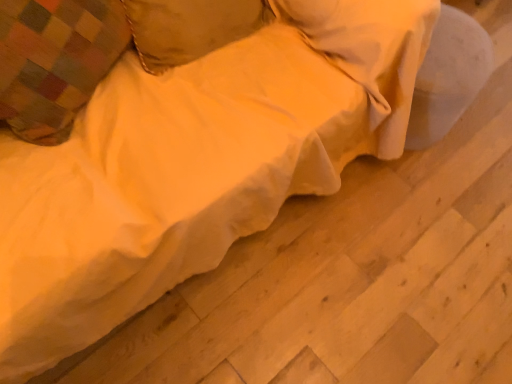
What is the approximate width of soft yellow fabric pillow at upper center, the second pillow positioned from the left?

soft yellow fabric pillow at upper center, the second pillow positioned from the left, is 8.26 inches in width.

The width and height of the screenshot is (512, 384). What do you see at coordinates (189, 28) in the screenshot?
I see `soft yellow fabric pillow at upper center, arranged as the first pillow when viewed from the right` at bounding box center [189, 28].

At what (x,y) coordinates should I click in order to perform the action: click on soft yellow fabric pillow at upper center, arranged as the first pillow when viewed from the right. Please return your answer as a coordinate pair (x, y). The height and width of the screenshot is (384, 512). Looking at the image, I should click on (189, 28).

You are a GUI agent. You are given a task and a screenshot of the screen. Output one action in this format:
    pyautogui.click(x=<x>, y=<y>)
    Task: Click on the plaid fabric pillow at upper left, placed as the first pillow when sorted from left to right
    The image size is (512, 384).
    Given the screenshot: What is the action you would take?
    pyautogui.click(x=55, y=61)

What is the approximate width of plaid fabric pillow at upper left, placed as the first pillow when sorted from left to right?

plaid fabric pillow at upper left, placed as the first pillow when sorted from left to right, is 8.71 inches wide.

The width and height of the screenshot is (512, 384). What do you see at coordinates (55, 61) in the screenshot? I see `plaid fabric pillow at upper left, placed as the first pillow when sorted from left to right` at bounding box center [55, 61].

This screenshot has width=512, height=384. I want to click on soft yellow fabric pillow at upper center, arranged as the first pillow when viewed from the right, so click(x=189, y=28).

Which object is positioned more to the right, plaid fabric pillow at upper left, the 2th pillow when ordered from right to left, or soft yellow fabric pillow at upper center, the second pillow positioned from the left?

Positioned to the right is soft yellow fabric pillow at upper center, the second pillow positioned from the left.

Does plaid fabric pillow at upper left, placed as the first pillow when sorted from left to right, lie behind soft yellow fabric pillow at upper center, the second pillow positioned from the left?

No.

Does point (118, 35) appear closer or farther from the camera than point (185, 39)?

Point (118, 35) is closer to the camera than point (185, 39).

From the image's perspective, is plaid fabric pillow at upper left, the 2th pillow when ordered from right to left, located above or below soft yellow fabric pillow at upper center, the second pillow positioned from the left?

plaid fabric pillow at upper left, the 2th pillow when ordered from right to left, is situated lower than soft yellow fabric pillow at upper center, the second pillow positioned from the left, in the image.

From a real-world perspective, is plaid fabric pillow at upper left, placed as the first pillow when sorted from left to right, positioned above or below soft yellow fabric pillow at upper center, arranged as the first pillow when viewed from the right?

plaid fabric pillow at upper left, placed as the first pillow when sorted from left to right, is above soft yellow fabric pillow at upper center, arranged as the first pillow when viewed from the right.

Which object is wider, plaid fabric pillow at upper left, the 2th pillow when ordered from right to left, or soft yellow fabric pillow at upper center, the second pillow positioned from the left?

With larger width is plaid fabric pillow at upper left, the 2th pillow when ordered from right to left.

Considering the sizes of plaid fabric pillow at upper left, the 2th pillow when ordered from right to left, and soft yellow fabric pillow at upper center, the second pillow positioned from the left, in the image, is plaid fabric pillow at upper left, the 2th pillow when ordered from right to left, taller or shorter than soft yellow fabric pillow at upper center, the second pillow positioned from the left,?

In the image, plaid fabric pillow at upper left, the 2th pillow when ordered from right to left, appears to be taller than soft yellow fabric pillow at upper center, the second pillow positioned from the left.

In terms of size, does plaid fabric pillow at upper left, the 2th pillow when ordered from right to left, appear bigger or smaller than soft yellow fabric pillow at upper center, arranged as the first pillow when viewed from the right?

In the image, plaid fabric pillow at upper left, the 2th pillow when ordered from right to left, appears to be larger than soft yellow fabric pillow at upper center, arranged as the first pillow when viewed from the right.

Would you say plaid fabric pillow at upper left, the 2th pillow when ordered from right to left, is outside soft yellow fabric pillow at upper center, the second pillow positioned from the left?

Yes, plaid fabric pillow at upper left, the 2th pillow when ordered from right to left, is not within soft yellow fabric pillow at upper center, the second pillow positioned from the left.

Does plaid fabric pillow at upper left, the 2th pillow when ordered from right to left, touch soft yellow fabric pillow at upper center, the second pillow positioned from the left?

plaid fabric pillow at upper left, the 2th pillow when ordered from right to left, and soft yellow fabric pillow at upper center, the second pillow positioned from the left, are not in contact.

Is plaid fabric pillow at upper left, placed as the first pillow when sorted from left to right, facing away from soft yellow fabric pillow at upper center, arranged as the first pillow when viewed from the right?

No.

At what (x,y) coordinates should I click in order to perform the action: click on pillow lying behind the plaid fabric pillow at upper left, the 2th pillow when ordered from right to left. Please return your answer as a coordinate pair (x, y). The width and height of the screenshot is (512, 384). Looking at the image, I should click on (189, 28).

Is soft yellow fabric pillow at upper center, the second pillow positioned from the left, to the left of plaid fabric pillow at upper left, placed as the first pillow when sorted from left to right, from the viewer's perspective?

No.

Is the depth of soft yellow fabric pillow at upper center, the second pillow positioned from the left, less than that of plaid fabric pillow at upper left, placed as the first pillow when sorted from left to right?

No, soft yellow fabric pillow at upper center, the second pillow positioned from the left, is further to the viewer.

Does point (155, 61) come closer to viewer compared to point (108, 47)?

No, (155, 61) is further to viewer.

From the image's perspective, which is above, soft yellow fabric pillow at upper center, the second pillow positioned from the left, or plaid fabric pillow at upper left, placed as the first pillow when sorted from left to right?

soft yellow fabric pillow at upper center, the second pillow positioned from the left, from the image's perspective.

From a real-world perspective, is soft yellow fabric pillow at upper center, arranged as the first pillow when viewed from the right, positioned over plaid fabric pillow at upper left, the 2th pillow when ordered from right to left, based on gravity?

No, from a real-world perspective, soft yellow fabric pillow at upper center, arranged as the first pillow when viewed from the right, is not over plaid fabric pillow at upper left, the 2th pillow when ordered from right to left

In the scene shown: Looking at their sizes, would you say soft yellow fabric pillow at upper center, the second pillow positioned from the left, is wider or thinner than plaid fabric pillow at upper left, the 2th pillow when ordered from right to left?

Clearly, soft yellow fabric pillow at upper center, the second pillow positioned from the left, has less width compared to plaid fabric pillow at upper left, the 2th pillow when ordered from right to left.

Considering the relative sizes of soft yellow fabric pillow at upper center, arranged as the first pillow when viewed from the right, and plaid fabric pillow at upper left, placed as the first pillow when sorted from left to right, in the image provided, is soft yellow fabric pillow at upper center, arranged as the first pillow when viewed from the right, shorter than plaid fabric pillow at upper left, placed as the first pillow when sorted from left to right,?

Yes.

Based on the photo, considering the relative sizes of soft yellow fabric pillow at upper center, arranged as the first pillow when viewed from the right, and plaid fabric pillow at upper left, the 2th pillow when ordered from right to left, in the image provided, is soft yellow fabric pillow at upper center, arranged as the first pillow when viewed from the right, smaller than plaid fabric pillow at upper left, the 2th pillow when ordered from right to left,?

Yes, soft yellow fabric pillow at upper center, arranged as the first pillow when viewed from the right, is smaller than plaid fabric pillow at upper left, the 2th pillow when ordered from right to left.

Would you say soft yellow fabric pillow at upper center, arranged as the first pillow when viewed from the right, is inside or outside plaid fabric pillow at upper left, the 2th pillow when ordered from right to left?

The correct answer is: outside.

Can you see soft yellow fabric pillow at upper center, arranged as the first pillow when viewed from the right, touching plaid fabric pillow at upper left, the 2th pillow when ordered from right to left?

soft yellow fabric pillow at upper center, arranged as the first pillow when viewed from the right, and plaid fabric pillow at upper left, the 2th pillow when ordered from right to left, are not in contact.

In the scene shown: Is soft yellow fabric pillow at upper center, arranged as the first pillow when viewed from the right, oriented towards plaid fabric pillow at upper left, the 2th pillow when ordered from right to left?

No.

Consider the image. Can you tell me how much soft yellow fabric pillow at upper center, arranged as the first pillow when viewed from the right, and plaid fabric pillow at upper left, placed as the first pillow when sorted from left to right, differ in facing direction?

soft yellow fabric pillow at upper center, arranged as the first pillow when viewed from the right, and plaid fabric pillow at upper left, placed as the first pillow when sorted from left to right, are facing 25.2 degrees away from each other.

Identify the location of pillow that appears on the right of plaid fabric pillow at upper left, the 2th pillow when ordered from right to left. This screenshot has width=512, height=384. (189, 28).

Locate an element on the screen. The image size is (512, 384). pillow above the plaid fabric pillow at upper left, placed as the first pillow when sorted from left to right (from the image's perspective) is located at coordinates (189, 28).

Where is `pillow on the right side of plaid fabric pillow at upper left, the 2th pillow when ordered from right to left`? The width and height of the screenshot is (512, 384). pillow on the right side of plaid fabric pillow at upper left, the 2th pillow when ordered from right to left is located at coordinates (189, 28).